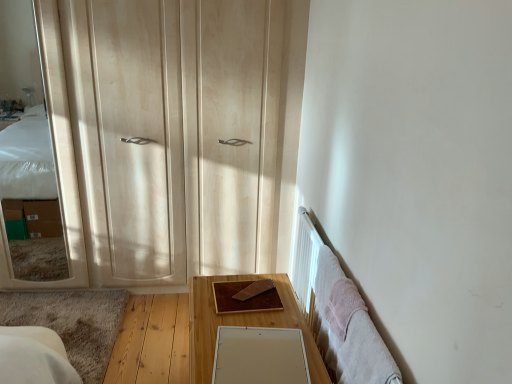
Question: In the image, is white matte mirror at lower center, which appears as the second mirror when viewed from the top, positioned in front of or behind brown wooden table at center?

Choices:
 (A) behind
 (B) front

Answer: (B)

Question: Is point (275, 342) positioned closer to the camera than point (199, 337)?

Choices:
 (A) farther
 (B) closer

Answer: (A)

Question: Which object is the closest to the brown wooden table at center?

Choices:
 (A) matte wooden mirror at left, arranged as the second mirror when viewed from the front
 (B) light wood dresser at left
 (C) white matte mirror at lower center, which appears as the 2th mirror when viewed from the back

Answer: (C)

Question: Which of these objects is positioned farthest from the matte wooden mirror at left, arranged as the second mirror when viewed from the front?

Choices:
 (A) white matte mirror at lower center, which appears as the 2th mirror when viewed from the back
 (B) brown wooden table at center
 (C) light wood dresser at left

Answer: (A)